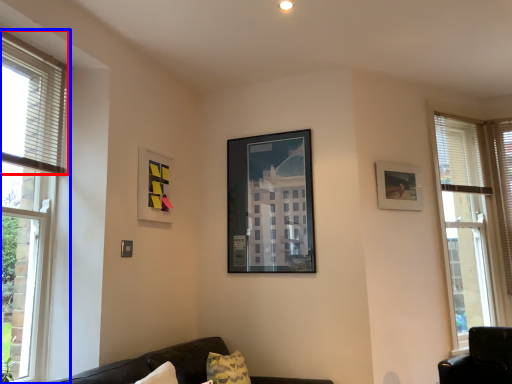
Question: Among these objects, which one is farthest to the camera, blind (highlighted by a red box) or window (highlighted by a blue box)?

Choices:
 (A) blind
 (B) window

Answer: (A)